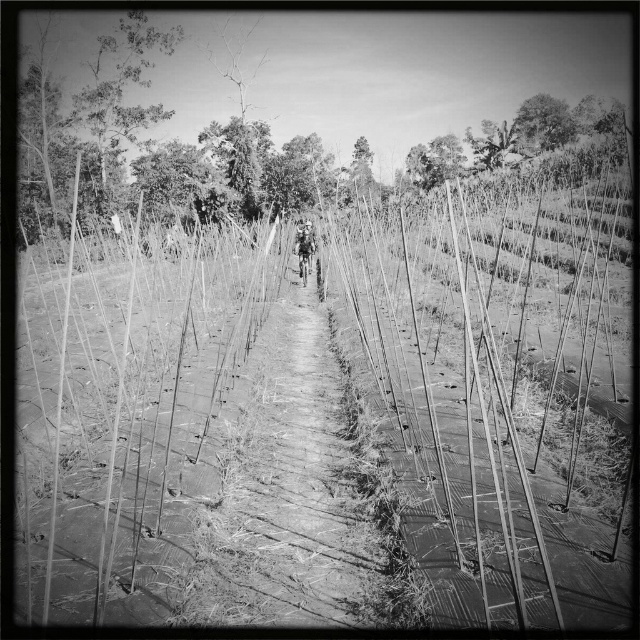
You are a hiker who wants to take a photo of the smooth bamboo at center and the smooth bark tree at upper center. Which object should you focus on first if you want both to be in sharp focus?

The smooth bamboo at center is much taller than the smooth bark tree at upper center, so you should focus on the smooth bamboo at center first to ensure both are in sharp focus.

You are a cyclist navigating a narrow dirt path bordered by tall plants. You notice smooth bamboo at center and thick foliage at center. Which of these two objects is located to the right of the other?

The smooth bamboo at center is positioned on the right side of thick foliage at center.